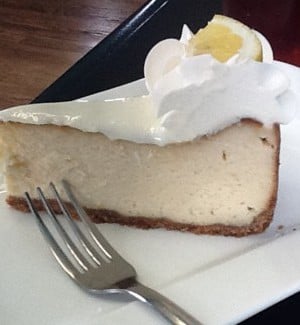
What are the coordinates of `plate` in the screenshot? It's located at (247, 283).